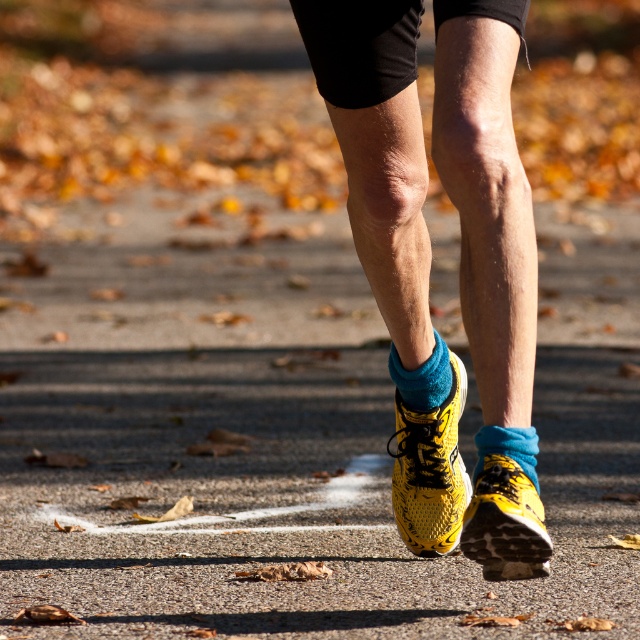
Based on the scene description, can you determine which object is positioned higher between the yellow mesh shoe at center and the blue fleece sock at lower center?

The blue fleece sock at lower center is positioned higher than the yellow mesh shoe at center because the yellow mesh shoe at center is below it.

You are standing on the path and see the yellow mesh shoe at lower center. If you want to pick up a leaf that is 4 meters away from you, can you reach it without moving your feet?

The yellow mesh shoe at lower center is 3.52 meters from the viewer. Since the leaf is 4 meters away, which is farther than the shoe, you cannot reach it without moving your feet.